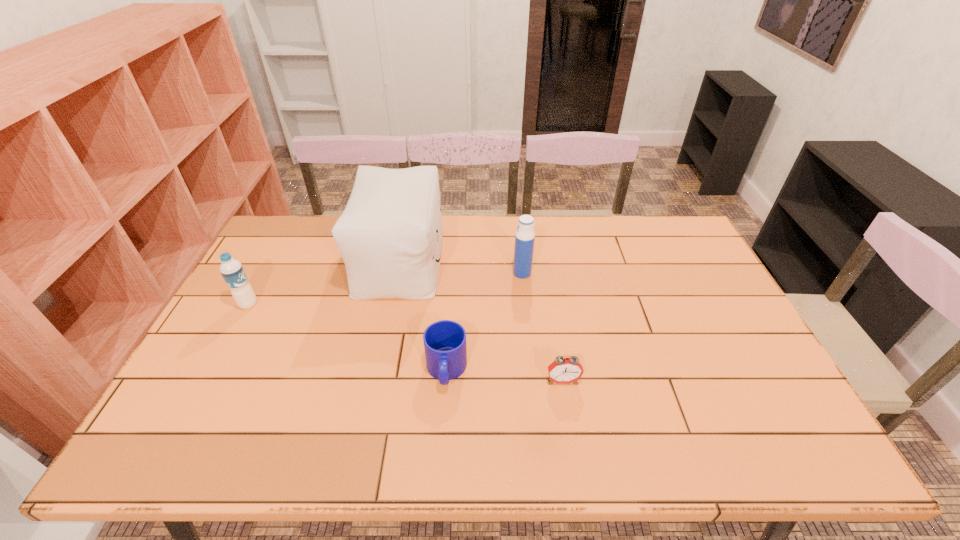
Image resolution: width=960 pixels, height=540 pixels. I want to click on the tallest object, so point(390,234).

Locate an element on the screen. This screenshot has width=960, height=540. the second object from right to left is located at coordinates (525, 236).

Locate an element on the screen. This screenshot has width=960, height=540. the right water bottle is located at coordinates (525, 236).

This screenshot has height=540, width=960. Find the location of `the leftmost object`. the leftmost object is located at coordinates (232, 271).

You are a GUI agent. You are given a task and a screenshot of the screen. Output one action in this format:
    pyautogui.click(x=<x>, y=<y>)
    Task: Click on the left water bottle
    Image resolution: width=960 pixels, height=540 pixels.
    Given the screenshot: What is the action you would take?
    pyautogui.click(x=232, y=271)

This screenshot has height=540, width=960. In order to click on mug in this screenshot , I will do `click(445, 348)`.

Find the location of `alarm clock`. alarm clock is located at coordinates (563, 370).

I want to click on vacant space located on the side of the cushion with the smiley face, so click(x=521, y=260).

Where is `free space located on the left of the farther water bottle`? Image resolution: width=960 pixels, height=540 pixels. free space located on the left of the farther water bottle is located at coordinates (485, 273).

Locate an element on the screen. The width and height of the screenshot is (960, 540). vacant space located 0.140m on the label of the leftmost object is located at coordinates (304, 305).